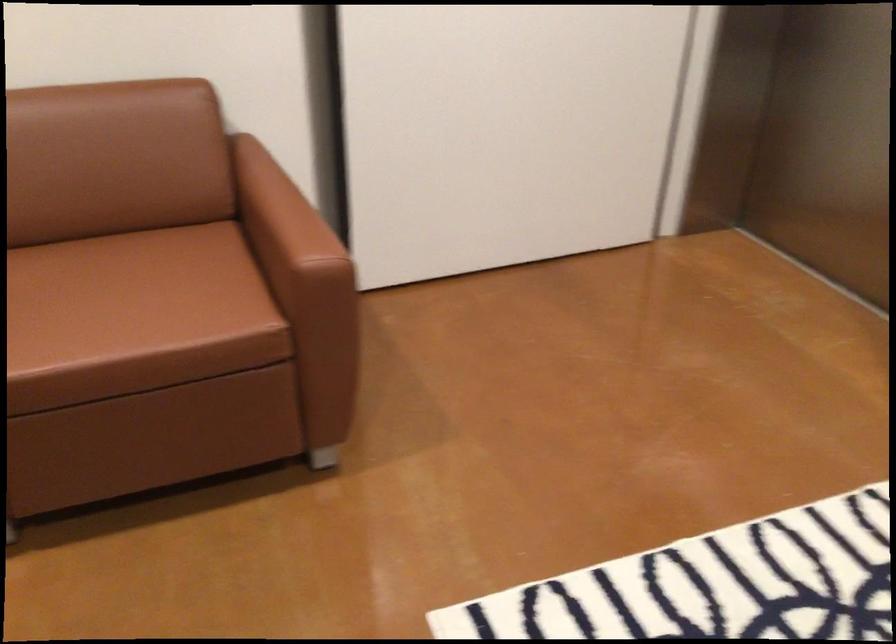
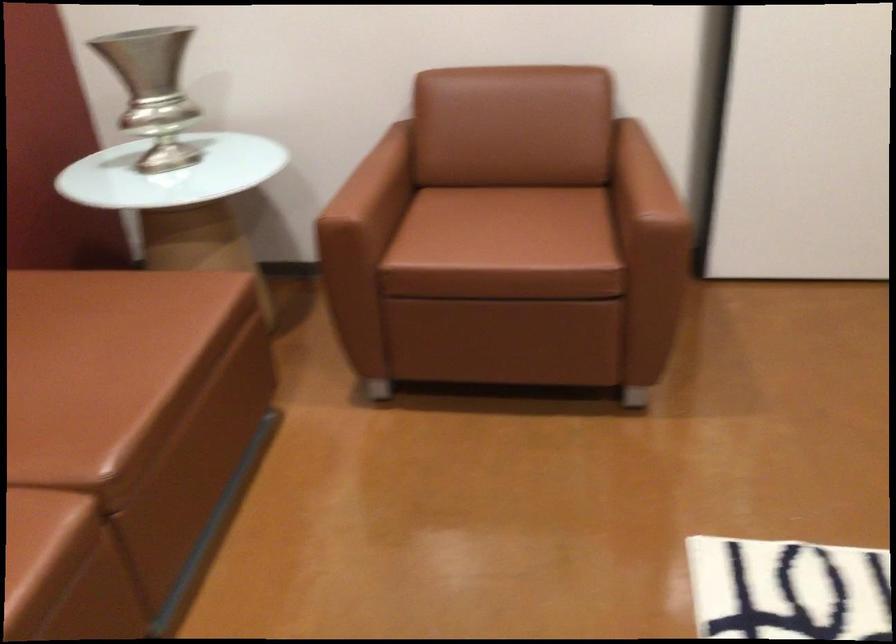
Question: The camera is either moving clockwise (left) or counter-clockwise (right) around the object. The first image is from the beginning of the video and the second image is from the end. Is the camera moving left or right when shooting the video?

Choices:
 (A) Left
 (B) Right

Answer: (B)